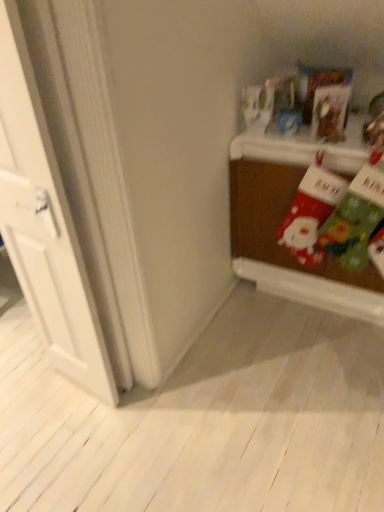
What is the approximate height of white wood door at left?

white wood door at left is 4.47 feet tall.

What do you see at coordinates (44, 224) in the screenshot? I see `white wood door at left` at bounding box center [44, 224].

Locate an element on the screen. The image size is (384, 512). white wood door at left is located at coordinates (44, 224).

This screenshot has height=512, width=384. I want to click on wooden table at right, so click(284, 218).

The width and height of the screenshot is (384, 512). Describe the element at coordinates (284, 218) in the screenshot. I see `wooden table at right` at that location.

Identify the location of white wood door at left. This screenshot has width=384, height=512. (44, 224).

Between white wood door at left and wooden table at right, which one appears on the left side from the viewer's perspective?

white wood door at left is more to the left.

Is the position of white wood door at left more distant than that of wooden table at right?

That is False.

Considering the positions of point (30, 106) and point (239, 164), is point (30, 106) closer or farther from the camera than point (239, 164)?

Clearly, point (30, 106) is closer to the camera than point (239, 164).

From the image's perspective, who appears lower, white wood door at left or wooden table at right?

white wood door at left.

In the scene shown: From a real-world perspective, is white wood door at left below wooden table at right?

No, from a real-world perspective, white wood door at left is not under wooden table at right.

Which object is wider, white wood door at left or wooden table at right?

With larger width is wooden table at right.

Considering the sizes of objects white wood door at left and wooden table at right in the image provided, who is shorter, white wood door at left or wooden table at right?

Standing shorter between the two is wooden table at right.

Is white wood door at left smaller than wooden table at right?

Yes.

Is white wood door at left not within wooden table at right?

Yes.

Can you see white wood door at left touching wooden table at right?

No, white wood door at left is not next to wooden table at right.

In the scene shown: Is white wood door at left oriented towards wooden table at right?

No, white wood door at left is not aimed at wooden table at right.

What's the angular difference between white wood door at left and wooden table at right's facing directions?

The angle between the facing direction of white wood door at left and the facing direction of wooden table at right is 1.3 degrees.

You are a GUI agent. You are given a task and a screenshot of the screen. Output one action in this format:
    pyautogui.click(x=<x>, y=<y>)
    Task: Click on the door in front of the wooden table at right
    This screenshot has height=512, width=384.
    Given the screenshot: What is the action you would take?
    pyautogui.click(x=44, y=224)

Consider the image. In the image, is wooden table at right on the left side or the right side of white wood door at left?

Clearly, wooden table at right is on the right of white wood door at left in the image.

Is the position of wooden table at right more distant than that of white wood door at left?

Yes.

Does point (344, 160) come behind point (57, 368)?

No, (344, 160) is closer to viewer.

From the image's perspective, does wooden table at right appear lower than white wood door at left?

No, from the image's perspective, wooden table at right is not beneath white wood door at left.

Based on the photo, from a real-world perspective, does wooden table at right stand above white wood door at left?

No.

Looking at their sizes, would you say wooden table at right is wider or thinner than white wood door at left?

In the image, wooden table at right appears to be wider than white wood door at left.

Considering the relative sizes of wooden table at right and white wood door at left in the image provided, is wooden table at right shorter than white wood door at left?

Indeed, wooden table at right has a lesser height compared to white wood door at left.

Is wooden table at right bigger or smaller than white wood door at left?

Clearly, wooden table at right is larger in size than white wood door at left.

Is wooden table at right located outside white wood door at left?

Yes, wooden table at right is not within white wood door at left.

Are wooden table at right and white wood door at left making contact?

No, wooden table at right is not next to white wood door at left.

Could you tell me if wooden table at right is turned towards white wood door at left?

Yes, wooden table at right is oriented towards white wood door at left.

Locate an element on the screen. Image resolution: width=384 pixels, height=512 pixels. table on the right of white wood door at left is located at coordinates (284, 218).

At what (x,y) coordinates should I click in order to perform the action: click on door in front of the wooden table at right. Please return your answer as a coordinate pair (x, y). Looking at the image, I should click on (44, 224).

The height and width of the screenshot is (512, 384). I want to click on door below the wooden table at right (from the image's perspective), so click(44, 224).